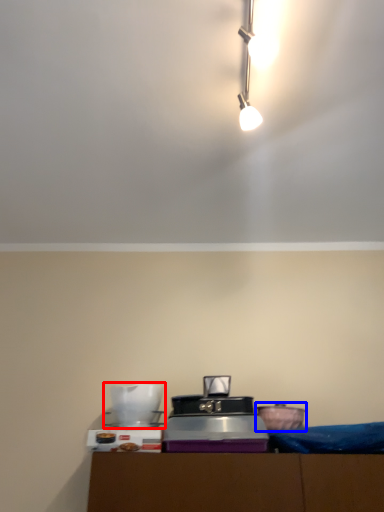
Question: Which object appears closest to the camera in this image, appliance (highlighted by a red box) or appliance (highlighted by a blue box)?

Choices:
 (A) appliance
 (B) appliance

Answer: (A)